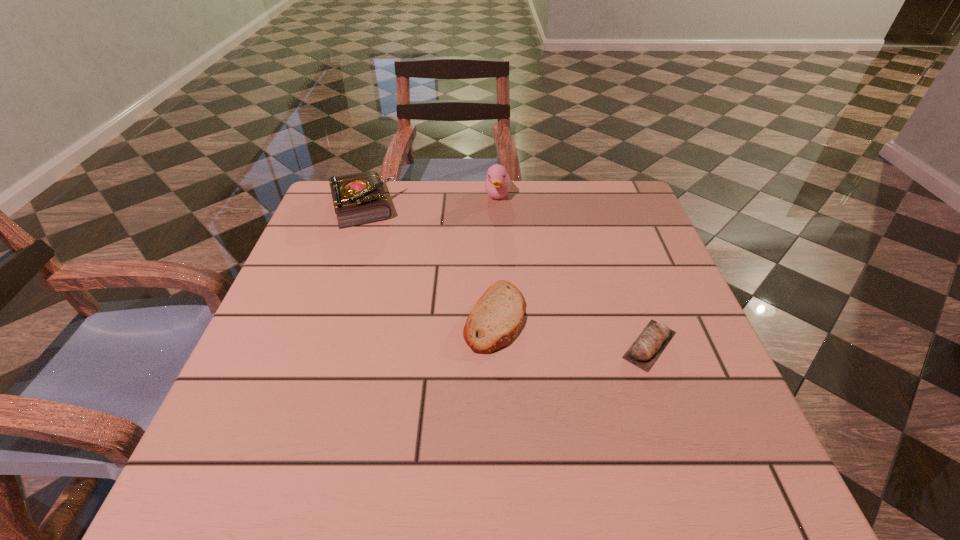
Identify the location of object identified as the third closest to the leftmost object. The height and width of the screenshot is (540, 960). (648, 346).

Locate an element on the screen. The width and height of the screenshot is (960, 540). object that ranks as the third closest to the left pita bread is located at coordinates (497, 185).

The width and height of the screenshot is (960, 540). In order to click on free space that satisfies the following two spatial constraints: 1. on the front side of the left pita bread; 2. on the right side of the third shortest object in this screenshot , I will do `click(324, 317)`.

Find the location of a particular element. Image resolution: width=960 pixels, height=540 pixels. free location that satisfies the following two spatial constraints: 1. on the front-facing side of the tallest object; 2. on the left side of the right pita bread is located at coordinates (506, 345).

You are a GUI agent. You are given a task and a screenshot of the screen. Output one action in this format:
    pyautogui.click(x=<x>, y=<y>)
    Task: Click on the vacant point that satisfies the following two spatial constraints: 1. on the front side of the leftmost object; 2. on the left side of the left pita bread
    Image resolution: width=960 pixels, height=540 pixels.
    Given the screenshot: What is the action you would take?
    pyautogui.click(x=324, y=317)